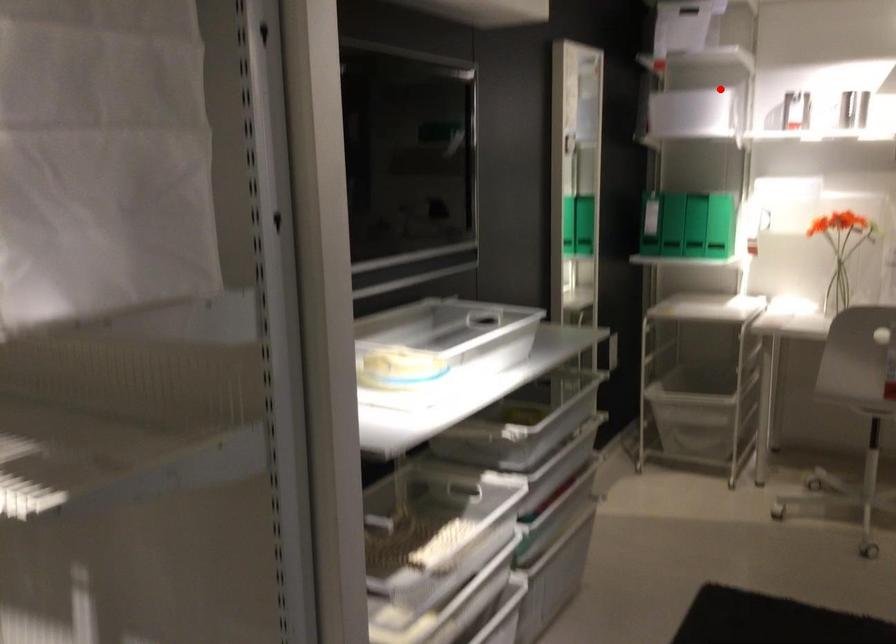
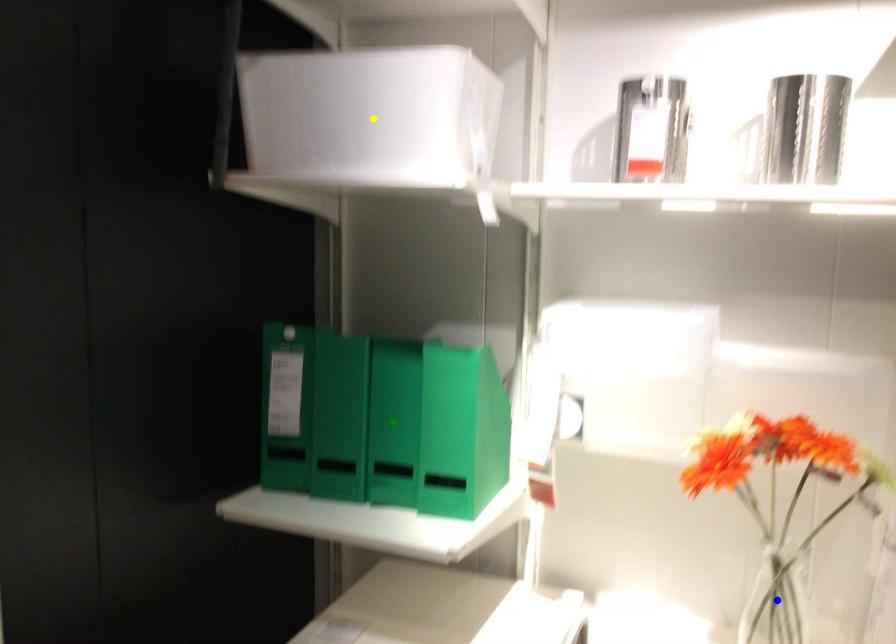
Question: I am providing you with two images of the same scene from different viewpoints. A red point is marked on the first image. You are given multiple points on the second image. Which mark in image 2 goes with the point in image 1?

Choices:
 (A) blue point
 (B) green point
 (C) yellow point

Answer: (C)